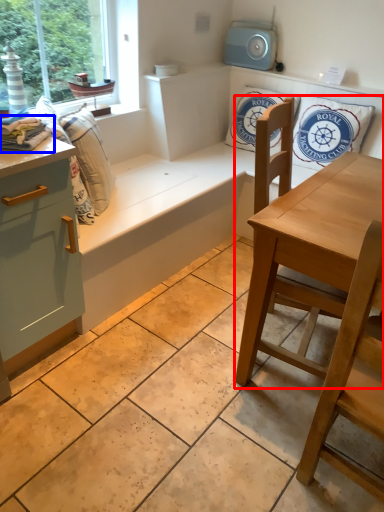
Question: Which object is closer to the camera taking this photo, chair (highlighted by a red box) or material (highlighted by a blue box)?

Choices:
 (A) chair
 (B) material

Answer: (A)